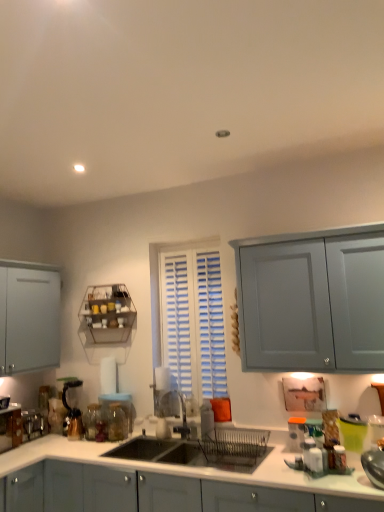
Where is `free space to the left of white glossy salt shaker at lower right, the 2th appliance in the left-to-right sequence`? free space to the left of white glossy salt shaker at lower right, the 2th appliance in the left-to-right sequence is located at coordinates (296, 476).